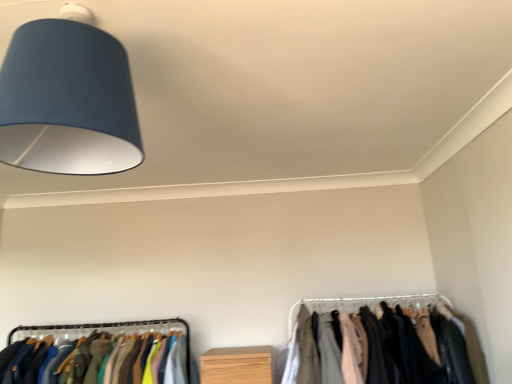
Question: Is silky fabric clothes at lower right in contact with matte blue lampshade at upper left?

Choices:
 (A) no
 (B) yes

Answer: (A)

Question: Is silky fabric clothes at lower right positioned beyond the bounds of matte blue lampshade at upper left?

Choices:
 (A) no
 (B) yes

Answer: (B)

Question: Is silky fabric clothes at lower right further to the viewer compared to matte blue lampshade at upper left?

Choices:
 (A) no
 (B) yes

Answer: (B)

Question: From the image's perspective, is silky fabric clothes at lower right below matte blue lampshade at upper left?

Choices:
 (A) no
 (B) yes

Answer: (B)

Question: Does silky fabric clothes at lower right appear on the right side of matte blue lampshade at upper left?

Choices:
 (A) yes
 (B) no

Answer: (A)

Question: Considering the relative sizes of silky fabric clothes at lower right and matte blue lampshade at upper left in the image provided, is silky fabric clothes at lower right taller than matte blue lampshade at upper left?

Choices:
 (A) yes
 (B) no

Answer: (A)

Question: Is matte blue lampshade at upper left oriented towards silky fabric clothes at lower right?

Choices:
 (A) yes
 (B) no

Answer: (B)

Question: From the image's perspective, is matte blue lampshade at upper left on silky fabric clothes at lower right?

Choices:
 (A) yes
 (B) no

Answer: (A)

Question: Does matte blue lampshade at upper left have a greater width compared to silky fabric clothes at lower right?

Choices:
 (A) yes
 (B) no

Answer: (B)

Question: Is matte blue lampshade at upper left next to silky fabric clothes at lower right and touching it?

Choices:
 (A) no
 (B) yes

Answer: (A)

Question: Is matte blue lampshade at upper left thinner than silky fabric clothes at lower right?

Choices:
 (A) no
 (B) yes

Answer: (B)

Question: Could silky fabric clothes at lower right be considered to be inside matte blue lampshade at upper left?

Choices:
 (A) no
 (B) yes

Answer: (A)

Question: From the image's perspective, relative to matte blue lampshade at upper left, is silky fabric clothes at lower right above or below?

Choices:
 (A) below
 (B) above

Answer: (A)